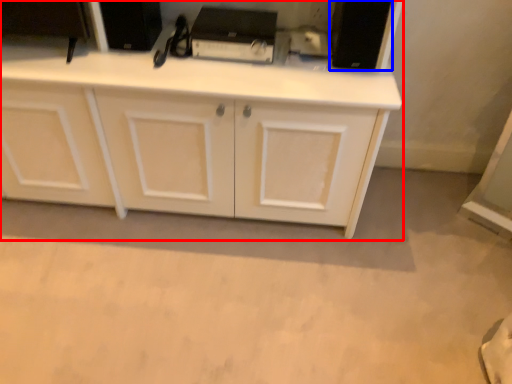
Question: Which point is closer to the camera, cabinetry (highlighted by a red box) or appliance (highlighted by a blue box)?

Choices:
 (A) cabinetry
 (B) appliance

Answer: (A)